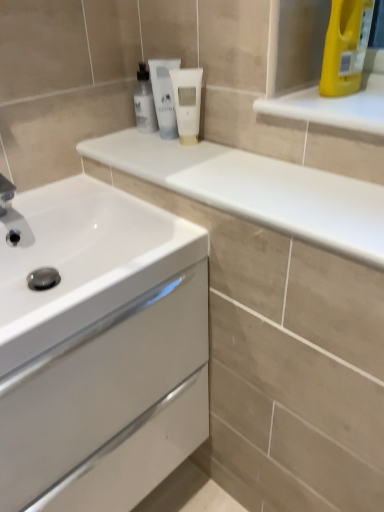
Identify the location of free point above white glossy countertop at upper center (from a real-world perspective). The width and height of the screenshot is (384, 512). (236, 169).